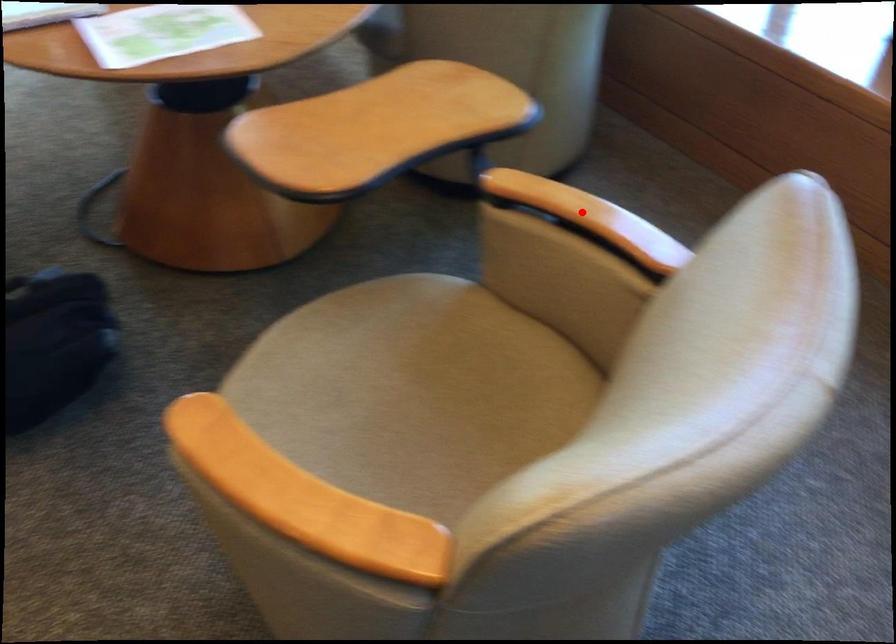
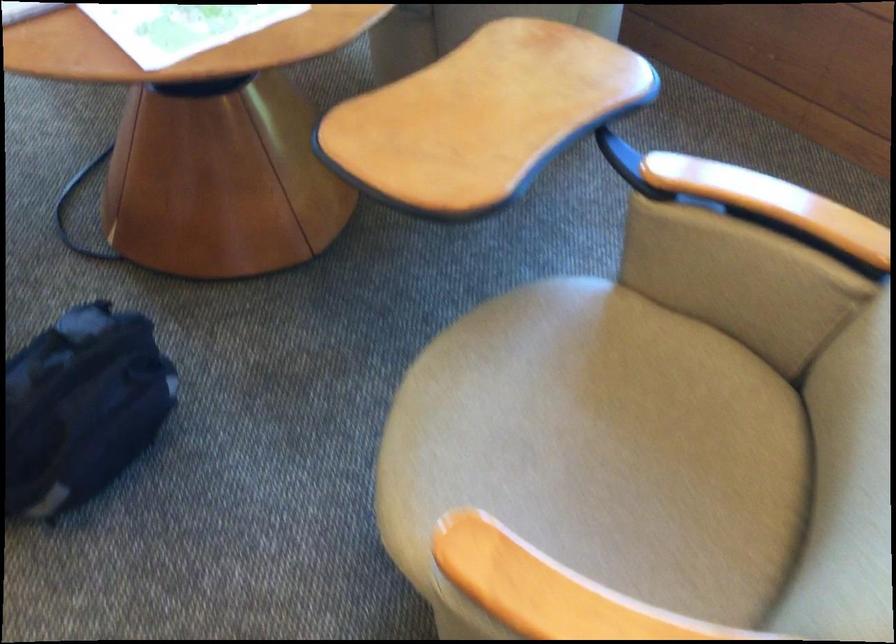
Question: A red point is marked in image1. In image2, is the corresponding 3D point closer to the camera or farther? Reply with the corresponding letter.

Choices:
 (A) The corresponding 3D point is closer.
 (B) The corresponding 3D point is farther.

Answer: (A)